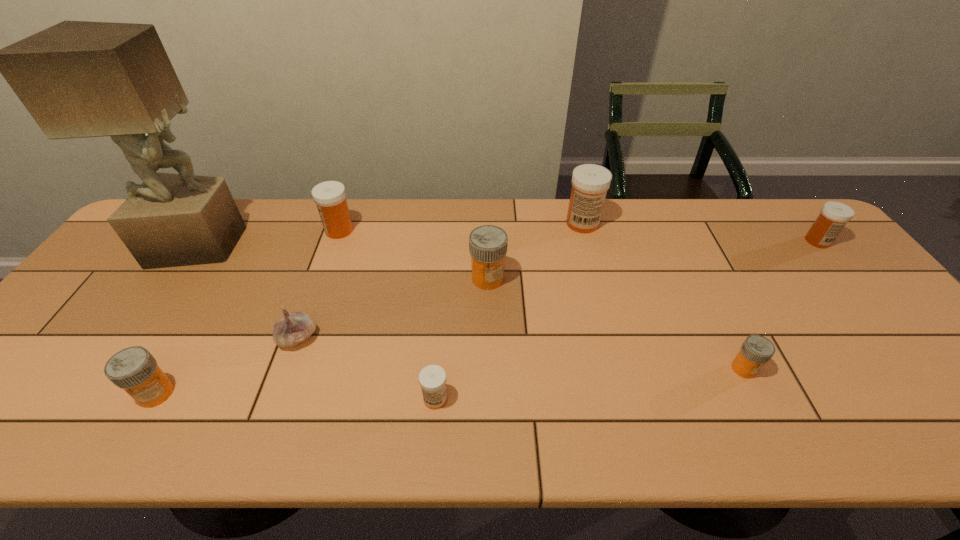
The image size is (960, 540). Identify the location of the leftmost medicine. (133, 369).

Locate an element on the screen. This screenshot has width=960, height=540. the second biggest orange medicine is located at coordinates (133, 369).

At what (x,y) coordinates should I click in order to perform the action: click on the fourth nearest object. Please return your answer as a coordinate pair (x, y). Image resolution: width=960 pixels, height=540 pixels. Looking at the image, I should click on (292, 328).

The image size is (960, 540). Identify the location of garlic. (292, 328).

I want to click on the smallest orange medicine, so click(756, 350).

Where is `the second medicine from right to left`? the second medicine from right to left is located at coordinates (756, 350).

Identify the location of the third medicine from left to right. (432, 378).

I want to click on the smallest white medicine, so click(x=432, y=378).

Where is `vacant space located on the front-facing side of the gray sculpture`? vacant space located on the front-facing side of the gray sculpture is located at coordinates (360, 244).

The width and height of the screenshot is (960, 540). I want to click on free point located 0.060m on the front of the second tallest object, so click(x=588, y=247).